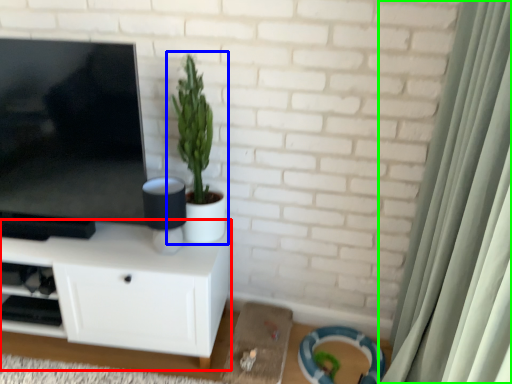
Question: Based on their relative distances, which object is nearer to cabinetry (highlighted by a red box)? Choose from houseplant (highlighted by a blue box) and curtain (highlighted by a green box).

Choices:
 (A) houseplant
 (B) curtain

Answer: (A)